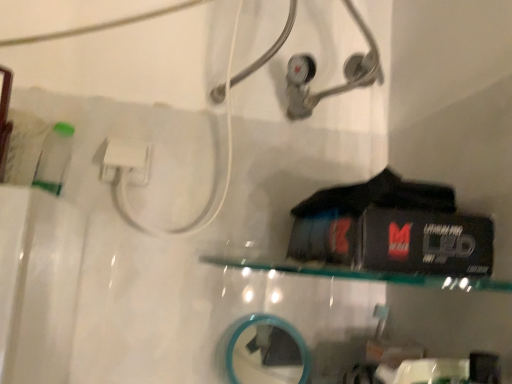
Question: Does clear glass shelf at center touch teal glass mirror at lower center?

Choices:
 (A) yes
 (B) no

Answer: (B)

Question: Is clear glass shelf at center at the left side of teal glass mirror at lower center?

Choices:
 (A) yes
 (B) no

Answer: (B)

Question: Is clear glass shelf at center thinner than teal glass mirror at lower center?

Choices:
 (A) no
 (B) yes

Answer: (A)

Question: From the image's perspective, is clear glass shelf at center on top of teal glass mirror at lower center?

Choices:
 (A) no
 (B) yes

Answer: (B)

Question: Can you confirm if clear glass shelf at center is positioned to the right of teal glass mirror at lower center?

Choices:
 (A) yes
 (B) no

Answer: (A)

Question: Does clear glass shelf at center have a greater height compared to teal glass mirror at lower center?

Choices:
 (A) no
 (B) yes

Answer: (A)

Question: Does teal glass mirror at lower center lie behind clear glass shelf at center?

Choices:
 (A) yes
 (B) no

Answer: (A)

Question: Is teal glass mirror at lower center closer to camera compared to clear glass shelf at center?

Choices:
 (A) yes
 (B) no

Answer: (B)

Question: Are teal glass mirror at lower center and clear glass shelf at center far apart?

Choices:
 (A) yes
 (B) no

Answer: (B)

Question: Is teal glass mirror at lower center at the right side of clear glass shelf at center?

Choices:
 (A) yes
 (B) no

Answer: (B)

Question: Can you confirm if teal glass mirror at lower center is bigger than clear glass shelf at center?

Choices:
 (A) yes
 (B) no

Answer: (B)

Question: Is teal glass mirror at lower center aimed at clear glass shelf at center?

Choices:
 (A) no
 (B) yes

Answer: (A)

Question: Does point (232, 352) appear closer or farther from the camera than point (415, 284)?

Choices:
 (A) closer
 (B) farther

Answer: (B)